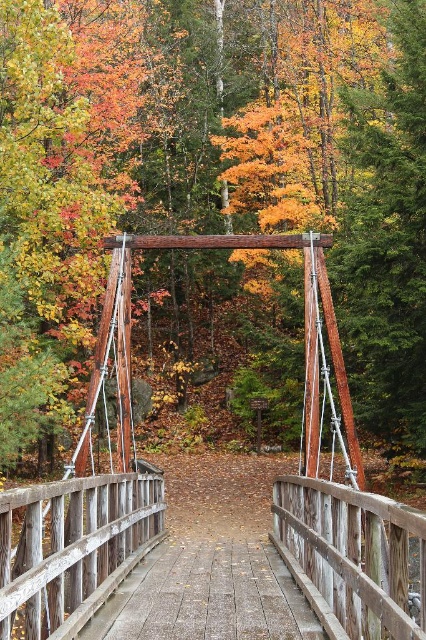
Is wooden swing at center to the right of wooden planks at center from the viewer's perspective?

In fact, wooden swing at center is to the left of wooden planks at center.

Can you confirm if wooden swing at center is wider than wooden planks at center?

Indeed, wooden swing at center has a greater width compared to wooden planks at center.

Where is `wooden swing at center`? The image size is (426, 640). wooden swing at center is located at coordinates (209, 180).

Which is above, wooden swing at center or wooden bridge at center?

Positioned higher is wooden swing at center.

Is wooden swing at center wider than wooden bridge at center?

Yes.

Does point (423, 106) lie in front of point (19, 620)?

No, (423, 106) is behind (19, 620).

This screenshot has height=640, width=426. I want to click on wooden swing at center, so coord(209,180).

Can you confirm if wooden bridge at center is positioned to the right of wooden planks at center?

In fact, wooden bridge at center is to the left of wooden planks at center.

Is wooden bridge at center closer to camera compared to wooden planks at center?

Yes, it is in front of wooden planks at center.

Who is more distant from viewer, (299, 557) or (83, 632)?

The point (299, 557) is more distant.

Image resolution: width=426 pixels, height=640 pixels. Identify the location of wooden bridge at center. (164, 496).